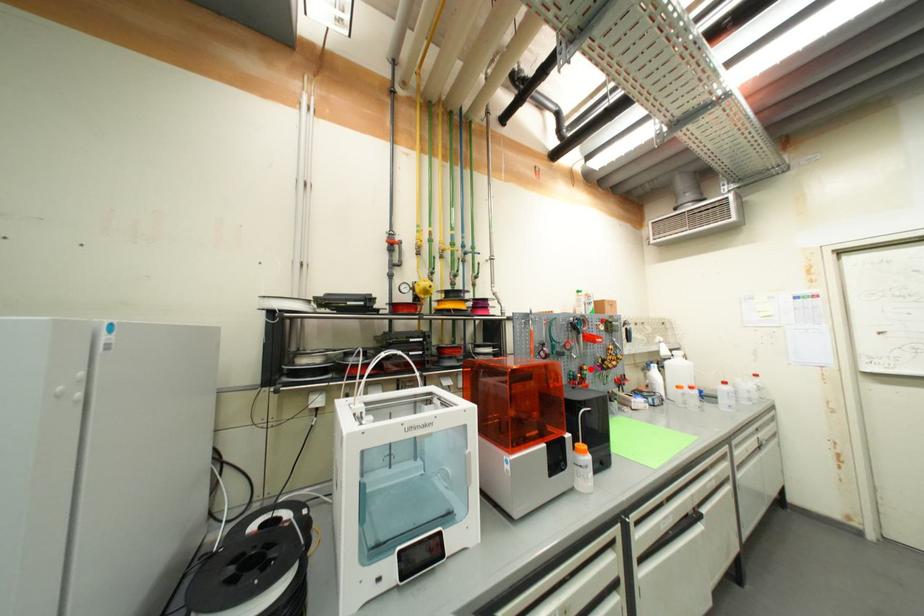
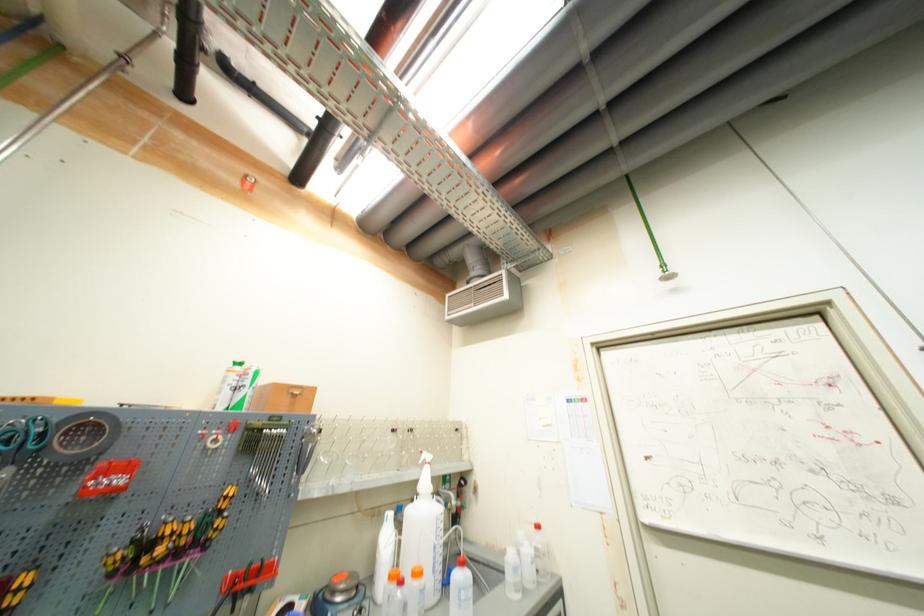
In the second image, find the point that corresponds to the highlighted location in the first image.

(30, 581)